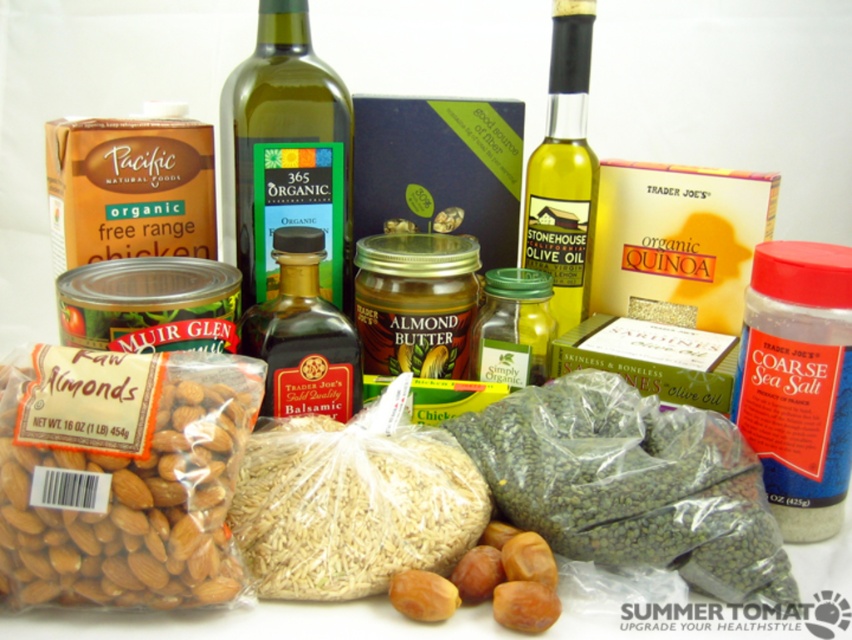
Is point (433, 460) positioned behind point (257, 304)?

No, (433, 460) is closer to viewer.

Can you confirm if translucent plastic rice at center is smaller than dark brown glass bottle at center?

Actually, translucent plastic rice at center might be larger than dark brown glass bottle at center.

Which is behind, point (407, 424) or point (330, 317)?

The point (330, 317) is more distant.

Where is `translucent plastic rice at center`? translucent plastic rice at center is located at coordinates (352, 506).

Consider the image. Does brown matte raw almonds at lower left appear under green matte lentils at center?

Actually, brown matte raw almonds at lower left is above green matte lentils at center.

Is brown matte raw almonds at lower left to the left of green matte lentils at center from the viewer's perspective?

Correct, you'll find brown matte raw almonds at lower left to the left of green matte lentils at center.

Which is behind, point (165, 408) or point (550, 545)?

Point (550, 545)

Find the location of a particular element. The height and width of the screenshot is (640, 852). brown matte raw almonds at lower left is located at coordinates (121, 476).

This screenshot has height=640, width=852. In order to click on brown matte raw almonds at lower left in this screenshot , I will do pos(121,476).

Does brown matte raw almonds at lower left have a greater height compared to green glass bottle at center?

Incorrect, brown matte raw almonds at lower left's height is not larger of green glass bottle at center's.

Is point (42, 355) in front of point (285, 13)?

Yes, it is in front of point (285, 13).

At what (x,y) coordinates should I click in order to perform the action: click on brown matte raw almonds at lower left. Please return your answer as a coordinate pair (x, y). Looking at the image, I should click on (121, 476).